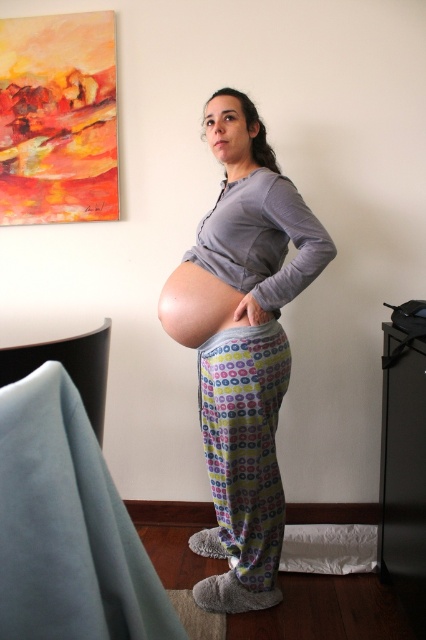
Question: Can you confirm if matte gray sweatshirt at center is positioned above matte skin at center?

Choices:
 (A) no
 (B) yes

Answer: (A)

Question: Which of these objects is positioned farthest from the matte gray sweatshirt at center?

Choices:
 (A) matte skin at center
 (B) printed cotton leggings at center

Answer: (A)

Question: Which of the following is the closest to the observer?

Choices:
 (A) (219, 356)
 (B) (268, 438)

Answer: (A)

Question: Can you confirm if matte gray sweatshirt at center is wider than matte skin at center?

Choices:
 (A) yes
 (B) no

Answer: (A)

Question: Which of the following is the farthest from the observer?

Choices:
 (A) matte skin at center
 (B) matte gray sweatshirt at center

Answer: (A)

Question: Is matte gray sweatshirt at center above matte skin at center?

Choices:
 (A) no
 (B) yes

Answer: (A)